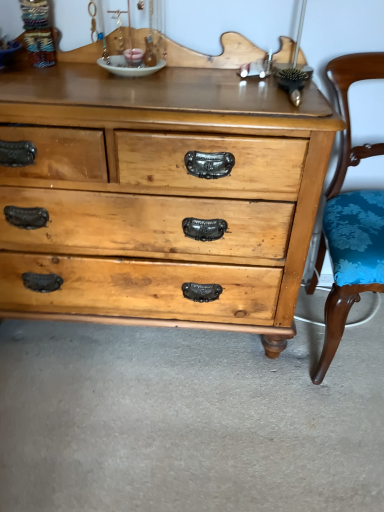
Locate an element on the screen. blue floral fabric chair at right is located at coordinates (350, 216).

Image resolution: width=384 pixels, height=512 pixels. Describe the element at coordinates (350, 216) in the screenshot. I see `blue floral fabric chair at right` at that location.

Locate an element on the screen. The image size is (384, 512). blue floral fabric chair at right is located at coordinates click(350, 216).